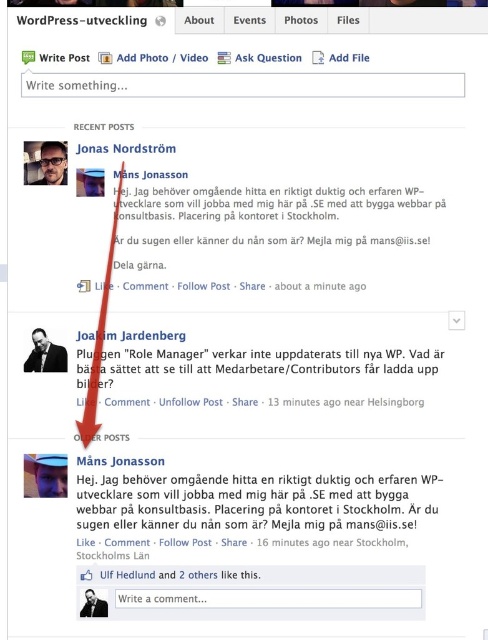
Question: Does matte black text at center come in front of black matte text at upper left?

Choices:
 (A) no
 (B) yes

Answer: (A)

Question: Can you confirm if matte black text at center is positioned to the right of black matte text at upper left?

Choices:
 (A) yes
 (B) no

Answer: (A)

Question: Does matte black text at center come in front of black matte text at upper left?

Choices:
 (A) yes
 (B) no

Answer: (B)

Question: Which point appears farthest from the camera in this image?

Choices:
 (A) (106, 24)
 (B) (427, 481)

Answer: (B)